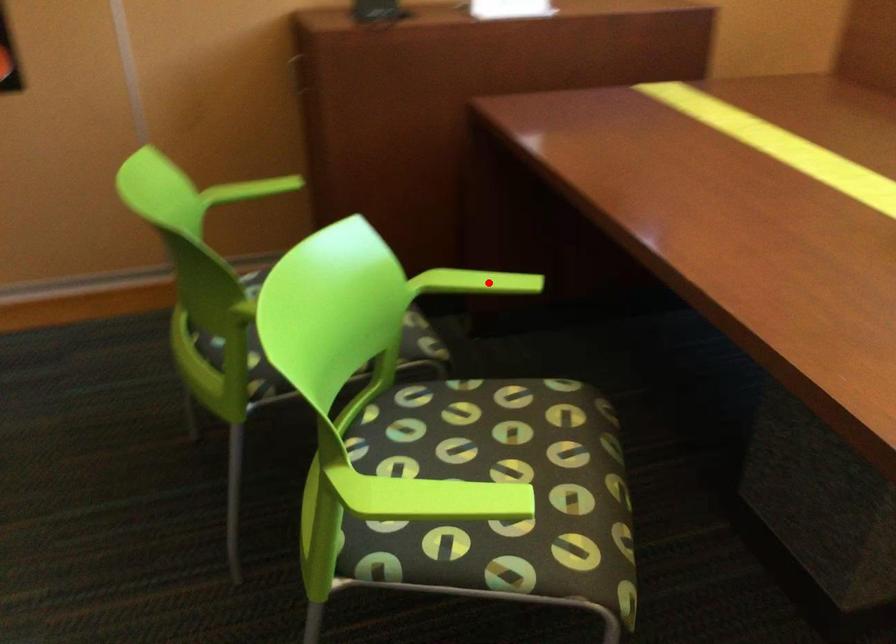
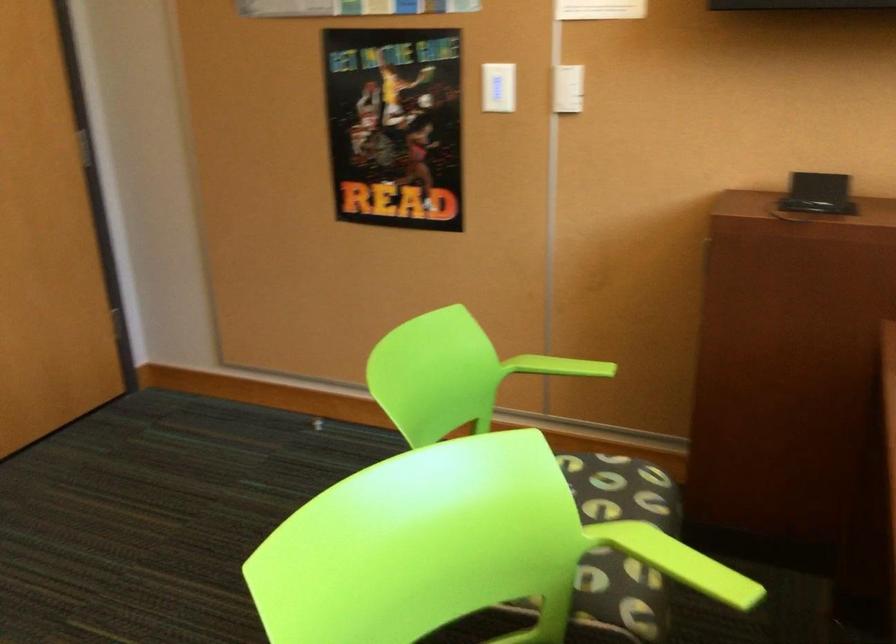
Question: A red point is marked in image1. In image2, is the corresponding 3D point closer to the camera or farther? Reply with the corresponding letter.

Choices:
 (A) The corresponding 3D point is closer.
 (B) The corresponding 3D point is farther.

Answer: (A)